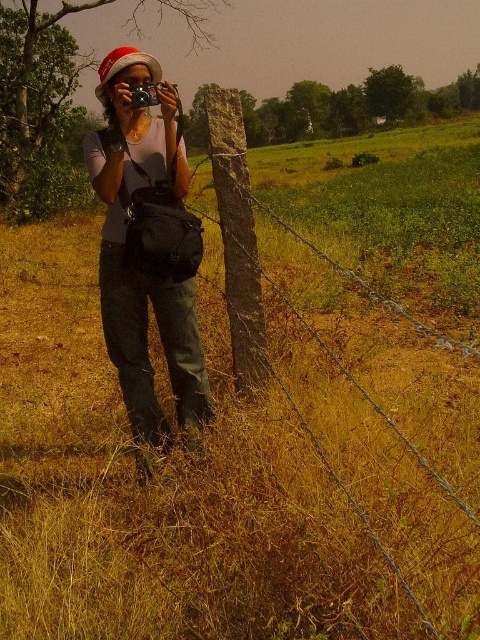
Can you confirm if matte black camera at center is positioned to the left of brown wooden post at center-left?

Yes, matte black camera at center is to the left of brown wooden post at center-left.

Is point (145, 212) farther from camera compared to point (297, 308)?

No.

Image resolution: width=480 pixels, height=640 pixels. Identify the location of matte black camera at center. (146, 248).

Which of these two, matte black camera at center or black plastic camera at center, stands taller?

matte black camera at center

Who is positioned more to the left, matte black camera at center or black plastic camera at center?

Positioned to the left is matte black camera at center.

Does point (135, 157) lie behind point (146, 99)?

Yes, point (135, 157) is behind point (146, 99).

Identify the location of matte black camera at center. (146, 248).

Between point (225, 188) and point (137, 108), which one is positioned in front?

Point (137, 108)

Does brown wooden post at center-left appear over black plastic camera at center?

Yes, brown wooden post at center-left is above black plastic camera at center.

The width and height of the screenshot is (480, 640). In order to click on brown wooden post at center-left in this screenshot , I will do `click(283, 291)`.